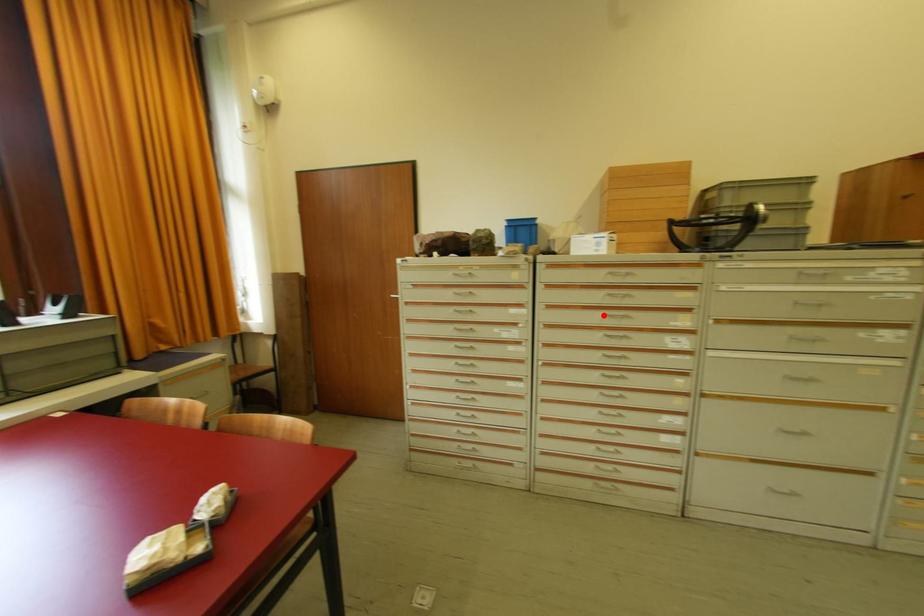
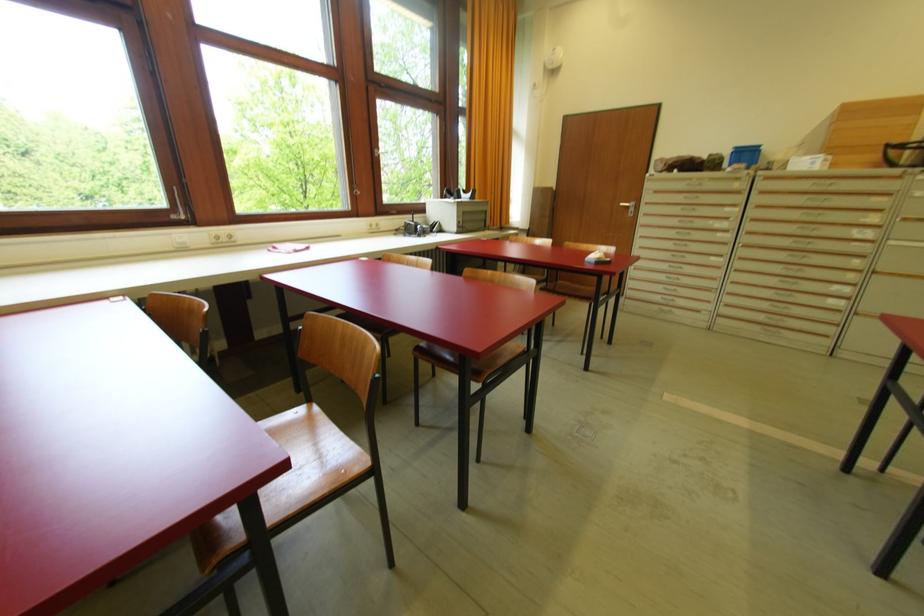
The point at the highlighted location is marked in the first image. Where is the corresponding point in the second image?

(804, 214)